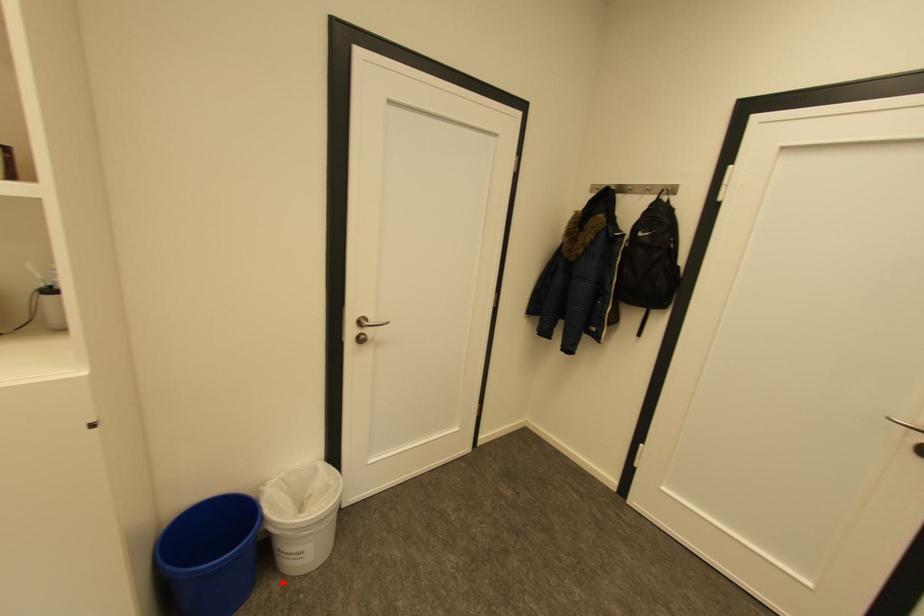
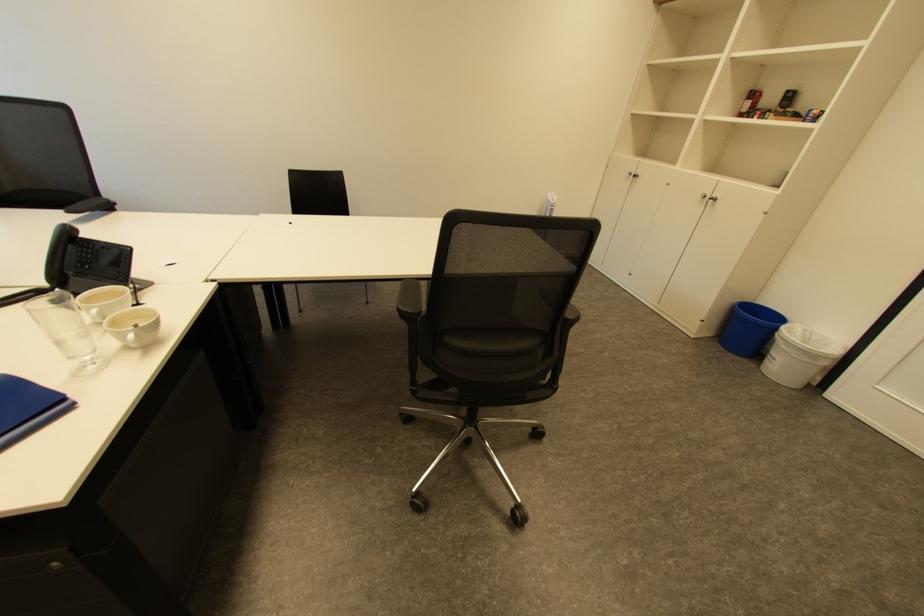
In the second image, find the point that corresponds to the highlighted location in the first image.

(760, 365)